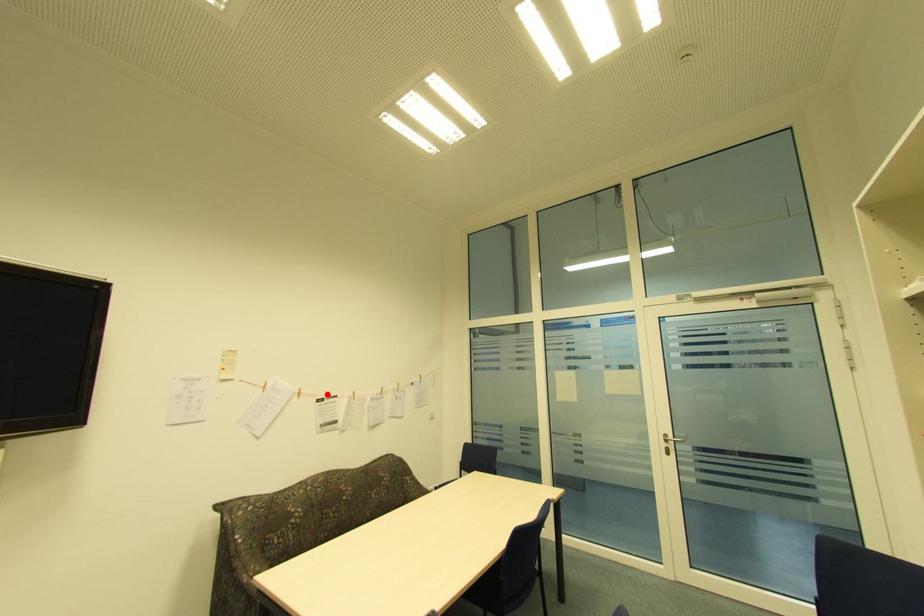
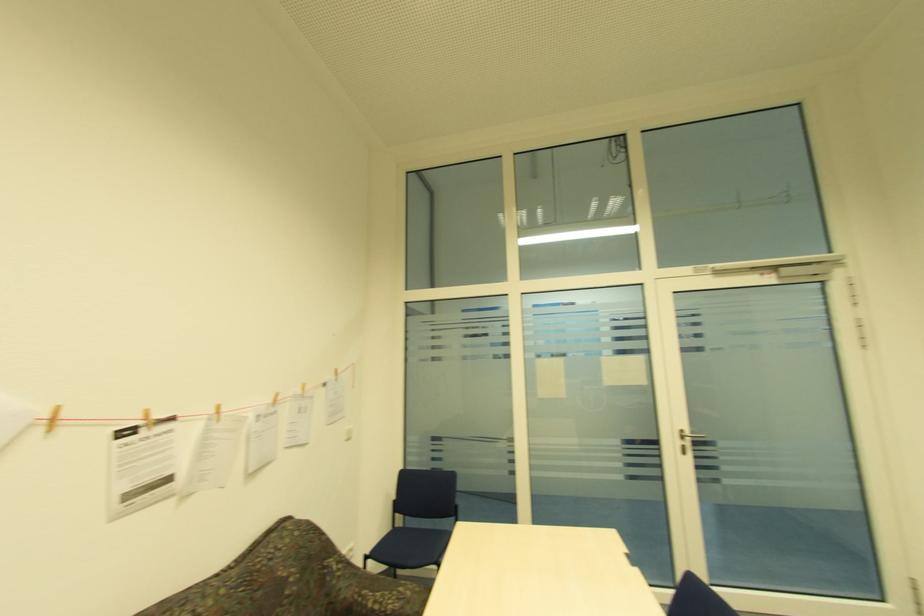
Locate, in the second image, the point that corresponds to the highlighted location in the first image.

(141, 416)